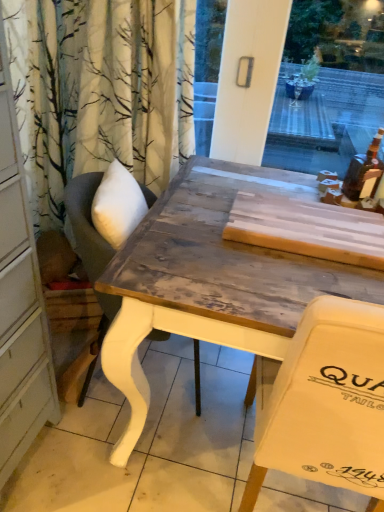
Locate an element on the screen. The image size is (384, 512). vacant space situated on the left part of wooden table at center is located at coordinates (146, 466).